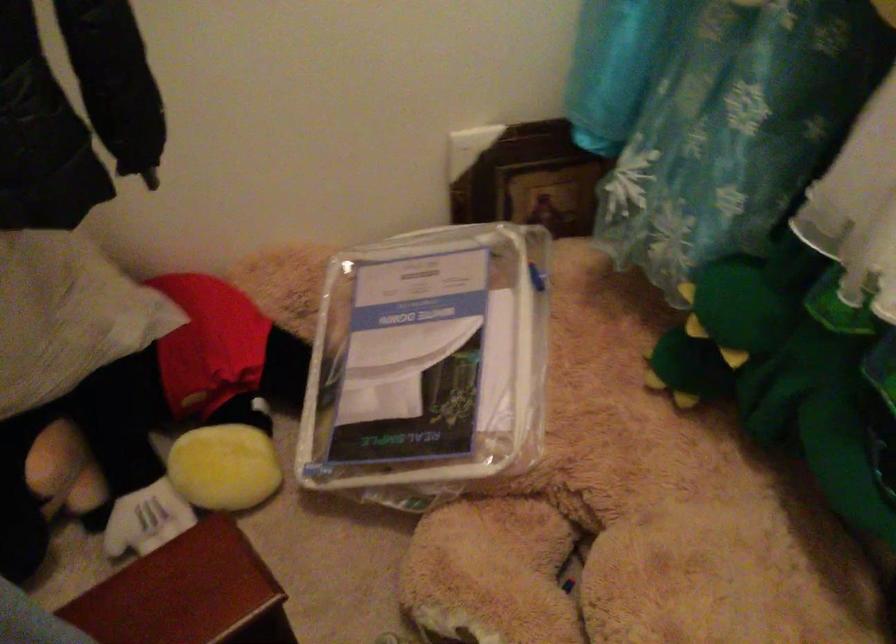
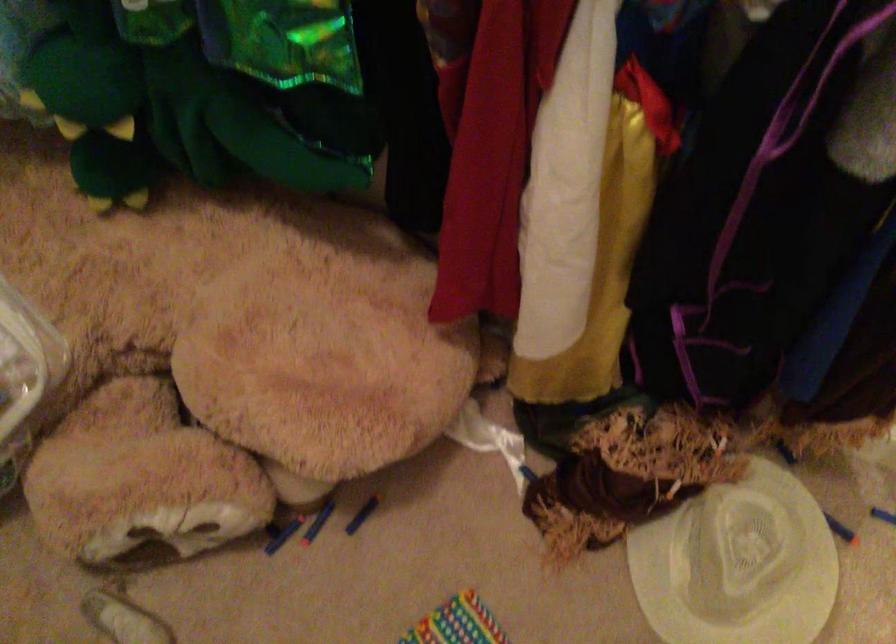
In the second image, find the point that corresponds to the point at 691,564 in the first image.

(247, 321)